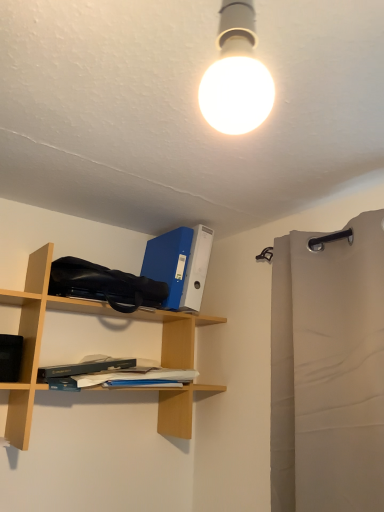
This screenshot has height=512, width=384. What are the coordinates of `beech wood shelf at left` in the screenshot? It's located at (35, 339).

What do you see at coordinates (328, 369) in the screenshot?
I see `beige fabric curtain at right` at bounding box center [328, 369].

Measure the distance between point [314,418] and camera.

Point [314,418] is 3.83 feet from camera.

Where is `hardcover book at center`? This screenshot has width=384, height=512. hardcover book at center is located at coordinates (114, 373).

Between beige fabric curtain at right and beech wood shelf at left, which one is positioned behind?

beech wood shelf at left is behind.

Is point (271, 489) positioned in front of point (194, 343)?

That is True.

Is beige fabric curtain at right touching beech wood shelf at left?

There is a gap between beige fabric curtain at right and beech wood shelf at left.

Can you confirm if beige fabric curtain at right is bigger than beech wood shelf at left?

No, beige fabric curtain at right is not bigger than beech wood shelf at left.

Which object is positioned more to the left, beech wood shelf at left or beige fabric curtain at right?

beech wood shelf at left is more to the left.

Is beech wood shelf at left far away from beige fabric curtain at right?

Actually, beech wood shelf at left and beige fabric curtain at right are a little close together.

Can you confirm if beech wood shelf at left is taller than beige fabric curtain at right?

In fact, beech wood shelf at left may be shorter than beige fabric curtain at right.

Considering the relative positions of beech wood shelf at left and beige fabric curtain at right in the image provided, is beech wood shelf at left behind beige fabric curtain at right?

That is True.

Find the location of a particular element. This screenshot has width=384, height=512. shelf to the left of hardcover book at center is located at coordinates click(35, 339).

Considering the sizes of objects hardcover book at center and beech wood shelf at left in the image provided, who is smaller, hardcover book at center or beech wood shelf at left?

hardcover book at center.

From the image's perspective, is hardcover book at center located beneath beech wood shelf at left?

Yes.

Is point (42, 369) farther from viewer compared to point (184, 426)?

No, (42, 369) is closer to viewer.

Is beech wood shelf at left surrounding hardcover book at center?

Indeed, hardcover book at center is located within beech wood shelf at left.

Based on their sizes in the image, would you say beech wood shelf at left is bigger or smaller than hardcover book at center?

beech wood shelf at left is bigger than hardcover book at center.

The image size is (384, 512). Find the location of `shelf above the hardcover book at center (from the image's perspective)`. shelf above the hardcover book at center (from the image's perspective) is located at coordinates (35, 339).

Is beige fabric curtain at right at the back of hardcover book at center?

No, hardcover book at center is not facing away from beige fabric curtain at right.

Is beige fabric curtain at right inside hardcover book at center?

No.

Measure the distance between hardcover book at center and beige fabric curtain at right.

hardcover book at center and beige fabric curtain at right are 56.52 centimeters apart.

Does point (301, 282) come behind point (164, 369)?

No, it is not.

In the scene shown: Are beige fabric curtain at right and hardcover book at center beside each other?

No, beige fabric curtain at right is not making contact with hardcover book at center.

From a real-world perspective, relative to hardcover book at center, is beige fabric curtain at right vertically above or below?

In terms of real-world spatial position, beige fabric curtain at right is above hardcover book at center.

Is beige fabric curtain at right taller or shorter than hardcover book at center?

Clearly, beige fabric curtain at right is taller compared to hardcover book at center.

The width and height of the screenshot is (384, 512). In order to click on shelf above the beige fabric curtain at right (from the image's perspective) in this screenshot , I will do `click(35, 339)`.

At what (x,y) coordinates should I click in order to perform the action: click on shelf behind the beige fabric curtain at right. Please return your answer as a coordinate pair (x, y). The height and width of the screenshot is (512, 384). Looking at the image, I should click on (35, 339).

Looking at the image, which one is located closer to beige fabric curtain at right, hardcover book at center or beech wood shelf at left?

Among the two, hardcover book at center is located nearer to beige fabric curtain at right.

Based on the photo, estimate the real-world distances between objects in this image. Which object is closer to beige fabric curtain at right, beech wood shelf at left or hardcover book at center?

hardcover book at center is closer to beige fabric curtain at right.

Considering their positions, is beech wood shelf at left positioned closer to hardcover book at center than beige fabric curtain at right?

The object closer to hardcover book at center is beech wood shelf at left.

Estimate the real-world distances between objects in this image. Which object is closer to beech wood shelf at left, beige fabric curtain at right or hardcover book at center?

hardcover book at center is positioned closer to the anchor beech wood shelf at left.

When comparing their distances from beech wood shelf at left, does hardcover book at center or beige fabric curtain at right seem closer?

The object closer to beech wood shelf at left is hardcover book at center.

Looking at the image, which one is located further to hardcover book at center, beige fabric curtain at right or beech wood shelf at left?

beige fabric curtain at right.

You are a GUI agent. You are given a task and a screenshot of the screen. Output one action in this format:
    pyautogui.click(x=<x>, y=<y>)
    Task: Click on the book between beech wood shelf at left and beige fabric curtain at right from left to right
    The image size is (384, 512).
    Given the screenshot: What is the action you would take?
    pyautogui.click(x=114, y=373)